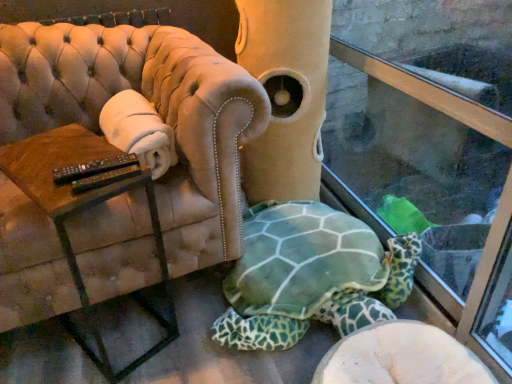
Question: Is velvet beige armchair at center smaller than transparent glass shop window at lower right?

Choices:
 (A) no
 (B) yes

Answer: (A)

Question: From the image's perspective, is velvet beige armchair at center beneath transparent glass shop window at lower right?

Choices:
 (A) yes
 (B) no

Answer: (B)

Question: Does velvet beige armchair at center turn towards transparent glass shop window at lower right?

Choices:
 (A) no
 (B) yes

Answer: (A)

Question: Can you confirm if velvet beige armchair at center is taller than transparent glass shop window at lower right?

Choices:
 (A) yes
 (B) no

Answer: (B)

Question: Is velvet beige armchair at center looking in the opposite direction of transparent glass shop window at lower right?

Choices:
 (A) no
 (B) yes

Answer: (A)

Question: Considering the positions of brown wooden table at left and green fabric tortoise at center in the image, is brown wooden table at left bigger or smaller than green fabric tortoise at center?

Choices:
 (A) big
 (B) small

Answer: (B)

Question: Is brown wooden table at left taller or shorter than green fabric tortoise at center?

Choices:
 (A) tall
 (B) short

Answer: (A)

Question: From a real-world perspective, relative to green fabric tortoise at center, is brown wooden table at left vertically above or below?

Choices:
 (A) below
 (B) above

Answer: (B)

Question: Considering the positions of point (74, 198) and point (279, 329), is point (74, 198) closer or farther from the camera than point (279, 329)?

Choices:
 (A) farther
 (B) closer

Answer: (B)

Question: Is green fabric tortoise at center taller or shorter than transparent glass shop window at lower right?

Choices:
 (A) short
 (B) tall

Answer: (A)

Question: From the image's perspective, relative to transparent glass shop window at lower right, is green fabric tortoise at center above or below?

Choices:
 (A) below
 (B) above

Answer: (A)

Question: Which is correct: green fabric tortoise at center is inside transparent glass shop window at lower right, or outside of it?

Choices:
 (A) inside
 (B) outside

Answer: (B)

Question: Is point click(x=296, y=324) positioned closer to the camera than point click(x=443, y=92)?

Choices:
 (A) farther
 (B) closer

Answer: (A)

Question: Is brown wooden table at left wider or thinner than velvet beige armchair at center?

Choices:
 (A) thin
 (B) wide

Answer: (A)

Question: From a real-world perspective, relative to velvet beige armchair at center, is brown wooden table at left vertically above or below?

Choices:
 (A) below
 (B) above

Answer: (A)